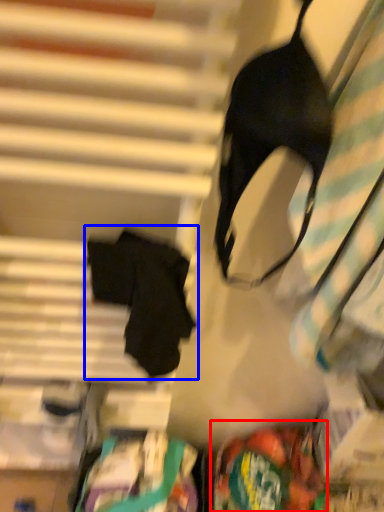
Question: Which object appears farthest to the camera in this image, waste (highlighted by a red box) or robe (highlighted by a blue box)?

Choices:
 (A) waste
 (B) robe

Answer: (A)